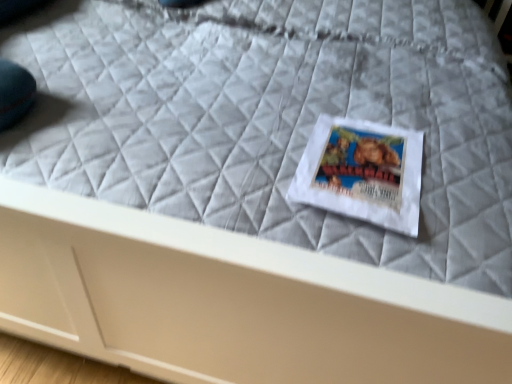
Identify the location of vacant space situated above white paper at center (from a real-world perspective). The height and width of the screenshot is (384, 512). (366, 162).